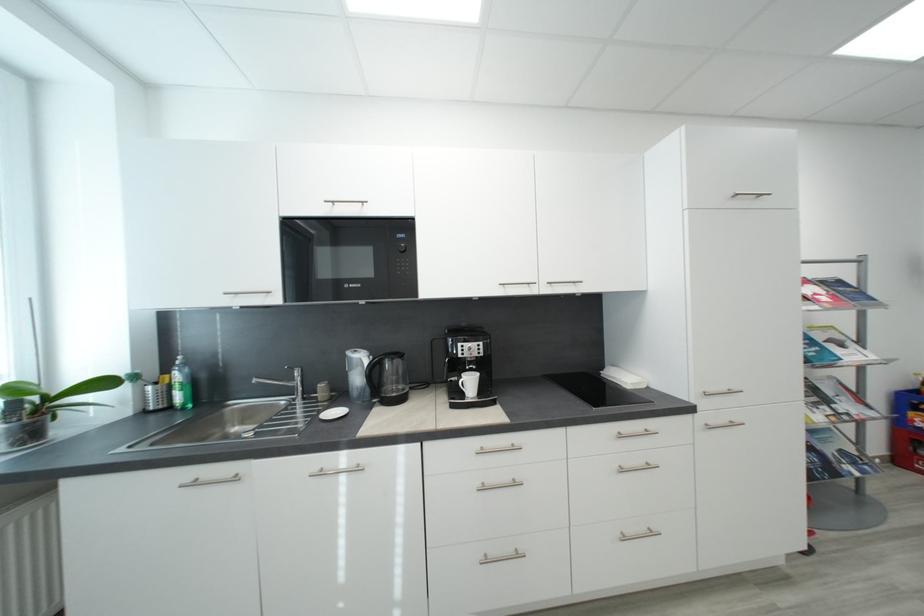
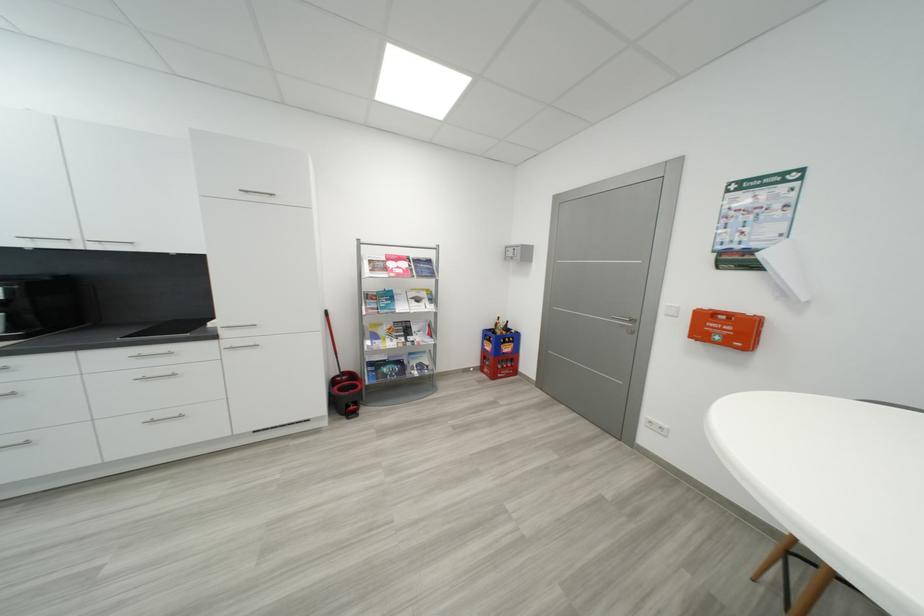
Locate, in the second image, the point that corresponds to point 833,392 in the first image.

(421, 330)